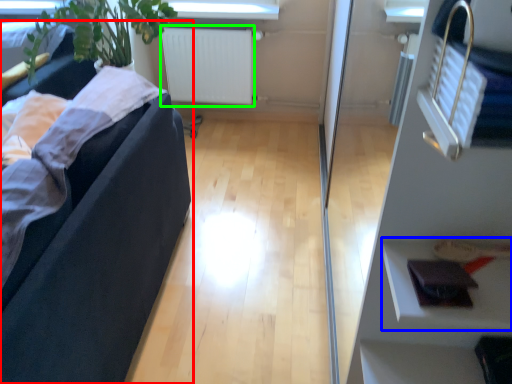
Question: Which is farther away from studio couch (highlighted by a red box)? shelf (highlighted by a blue box) or radiator (highlighted by a green box)?

Choices:
 (A) shelf
 (B) radiator

Answer: (B)